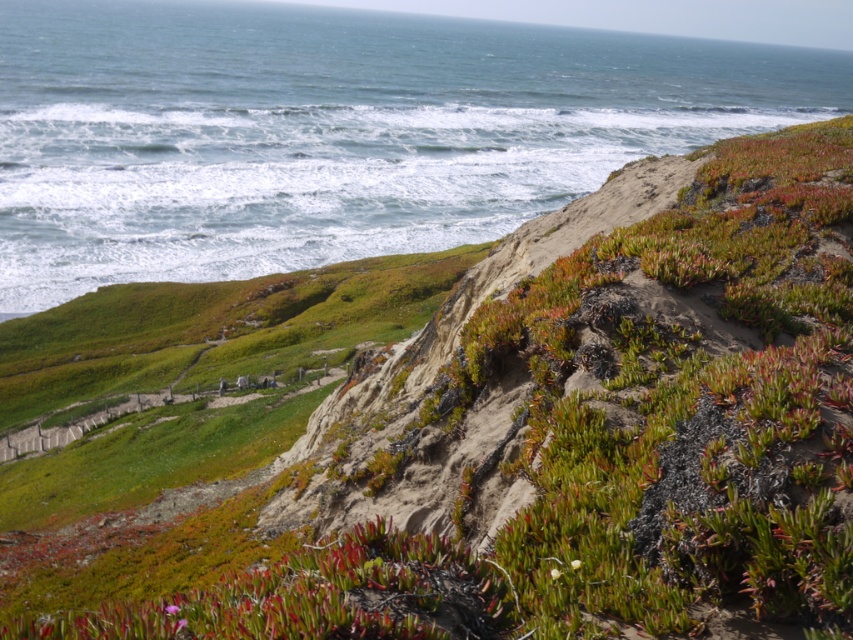
You are standing on the grassy path bordered by wooden railings and looking towards the center of the image. There is a point marked at coordinates (171, 609). What color petals can you see at that exact point?

At point (171, 609), there are vivid pink petals.

You are standing at the starting point of the grassy path on the cliff. You see two points marked in the image. Which point is closer to you? The options are point 1 at coordinates point (505, 220) and point 2 at coordinates point (184, 624).

Point 2 at coordinates point (184, 624) is closer to you because point (505, 220) is behind point (184, 624).